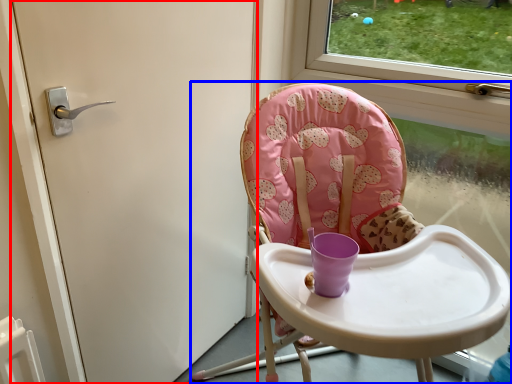
Question: Which point is further to the camera, door (highlighted by a red box) or chair (highlighted by a blue box)?

Choices:
 (A) door
 (B) chair

Answer: (A)